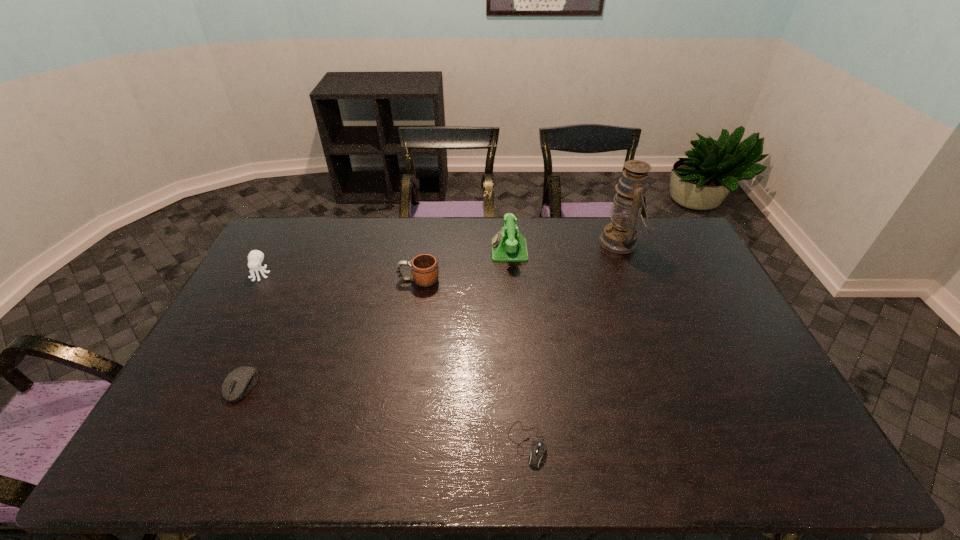
This screenshot has width=960, height=540. Identify the location of the rightmost object. (620, 236).

Locate an element on the screen. This screenshot has height=540, width=960. oil lamp is located at coordinates (620, 236).

Image resolution: width=960 pixels, height=540 pixels. I want to click on the fifth shortest object, so click(508, 245).

The image size is (960, 540). What are the coordinates of `the leftmost object` in the screenshot? It's located at (255, 257).

Where is `the fourth object from right to left`? the fourth object from right to left is located at coordinates (424, 268).

Where is `the farther computer mouse`? Image resolution: width=960 pixels, height=540 pixels. the farther computer mouse is located at coordinates (239, 382).

The height and width of the screenshot is (540, 960). I want to click on the fifth tallest object, so click(x=239, y=382).

The width and height of the screenshot is (960, 540). What are the coordinates of `the right computer mouse` in the screenshot? It's located at (535, 459).

Locate an element on the screen. This screenshot has height=540, width=960. the nearest object is located at coordinates (535, 459).

The width and height of the screenshot is (960, 540). I want to click on free location located 0.320m on the front of the tallest object, so click(653, 327).